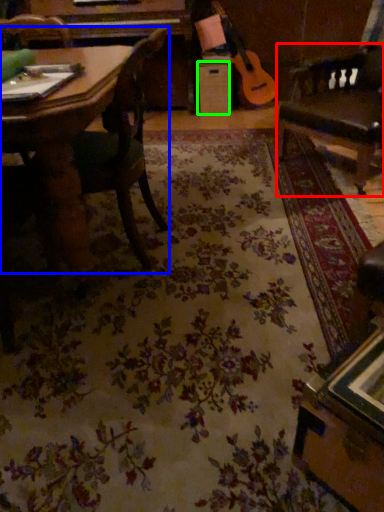
Question: Estimate the real-world distances between objects in this image. Which object is closer to swivel chair (highlighted by a red box), chair (highlighted by a blue box) or drawer (highlighted by a green box)?

Choices:
 (A) chair
 (B) drawer

Answer: (A)